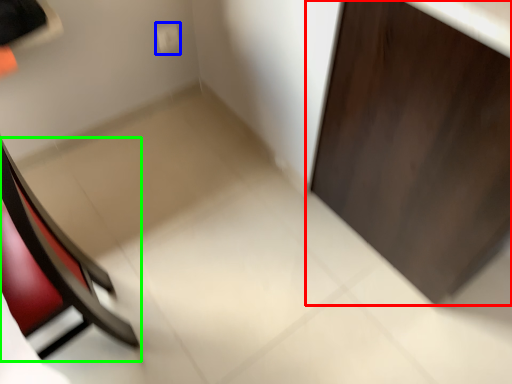
Question: Based on their relative distances, which object is farther from door (highlighted by a red box)? Choose from electric outlet (highlighted by a blue box) and chair (highlighted by a green box).

Choices:
 (A) electric outlet
 (B) chair

Answer: (A)